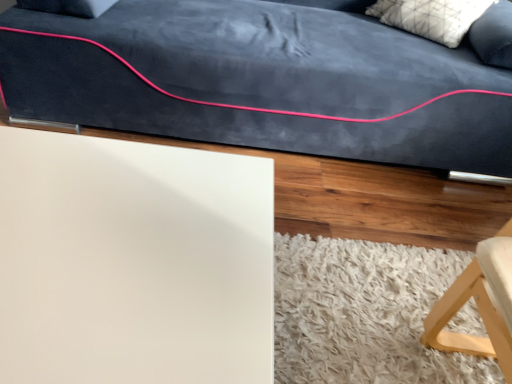
Question: From the image's perspective, relative to white matte board at lower left, is white textured pillow at upper right above or below?

Choices:
 (A) above
 (B) below

Answer: (A)

Question: Does point (446, 34) appear closer or farther from the camera than point (234, 226)?

Choices:
 (A) farther
 (B) closer

Answer: (A)

Question: Which object is the closest to the white shaggy rug at lower right?

Choices:
 (A) white matte board at lower left
 (B) white textured pillow at upper right

Answer: (A)

Question: Which of these objects is positioned farthest from the white textured pillow at upper right?

Choices:
 (A) white matte board at lower left
 (B) white shaggy rug at lower right

Answer: (A)